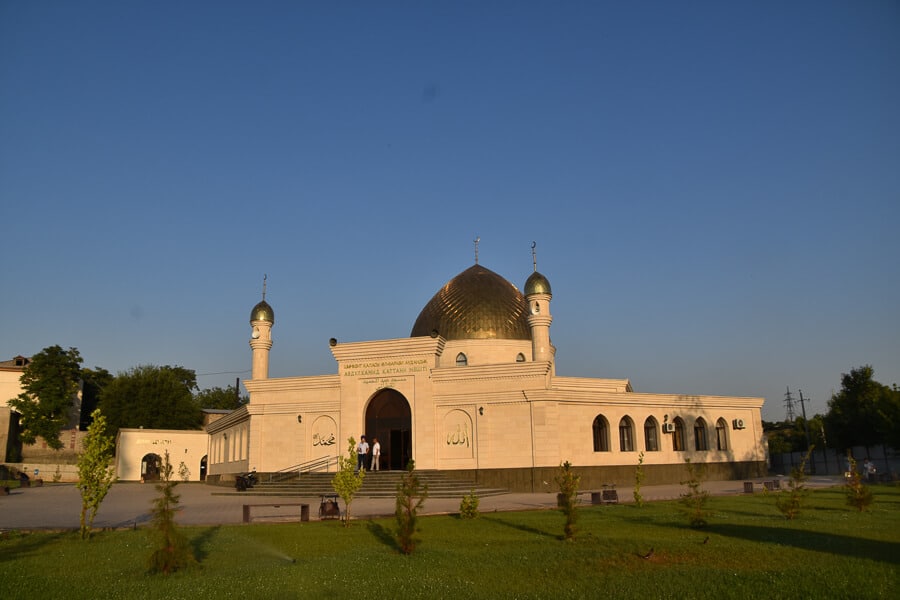
This screenshot has height=600, width=900. In order to click on hand rail in this screenshot , I will do `click(289, 473)`, `click(312, 469)`, `click(328, 463)`.